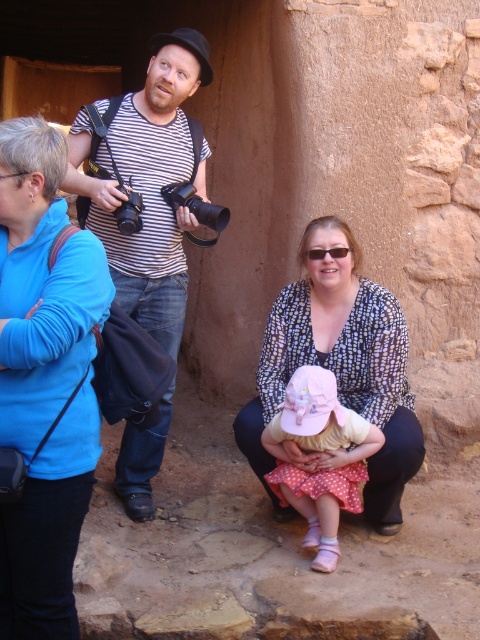
Does black plastic camera at center have a greater width compared to black plastic camera at upper center?

Yes, black plastic camera at center is wider than black plastic camera at upper center.

Is point (175, 216) in front of point (141, 220)?

No.

Image resolution: width=480 pixels, height=640 pixels. What are the coordinates of `black plastic camera at center` in the screenshot? It's located at (195, 209).

Does blue fleece jacket at upper left have a lesser width compared to polka dot blouse at center?

Yes.

Between point (76, 408) and point (365, 392), which one is positioned behind?

The point (365, 392) is more distant.

Where is `blue fleece jacket at upper left`? blue fleece jacket at upper left is located at coordinates (45, 380).

Find the location of a particular element. This screenshot has width=480, height=640. blue fleece jacket at upper left is located at coordinates coord(45,380).

Who is more forward, (263,413) or (187,236)?

Positioned in front is point (263,413).

Find the location of a particular element. Image resolution: width=480 pixels, height=640 pixels. polka dot blouse at center is located at coordinates (339, 364).

I want to click on polka dot blouse at center, so click(339, 364).